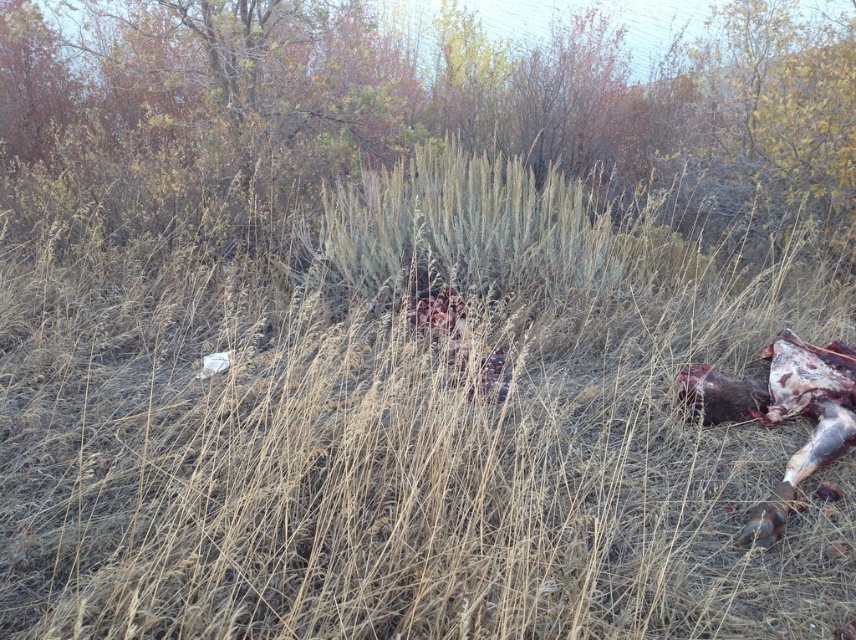
You are a wildlife photographer aiming to capture a closeup of the brown fur animal at lower right without stepping on the green grass at center. Can you approach the animal from the direction of the dry grasses in the foreground?

The green grass at center is located above the brown fur animal at lower right, so approaching from the direction of the dry grasses in the foreground would mean moving towards the animal from below. This might be possible as long as you stay on the dry grasses and avoid the area above the animal where the green grass at center is located.